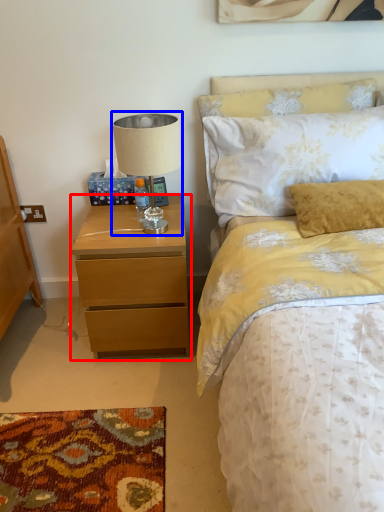
Question: Among these objects, which one is farthest to the camera, nightstand (highlighted by a red box) or table lamp (highlighted by a blue box)?

Choices:
 (A) nightstand
 (B) table lamp

Answer: (A)